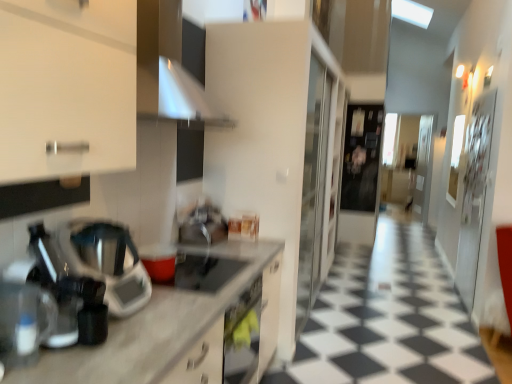
You are a GUI agent. You are given a task and a screenshot of the screen. Output one action in this format:
    pyautogui.click(x=<x>, y=<y>)
    Task: Click on the free point to the right of satin silver sink at center
    The image size is (512, 384).
    Given the screenshot: What is the action you would take?
    pyautogui.click(x=242, y=242)